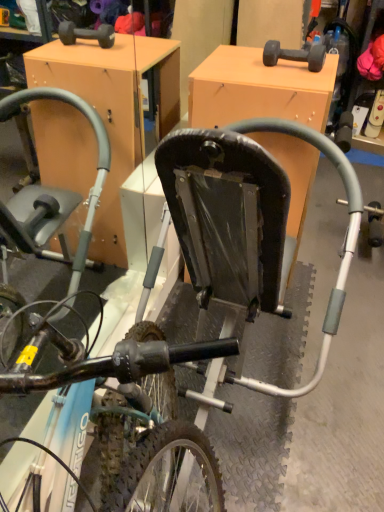
Question: Considering the positions of matte orange cabinet at center and metallic silver bicycle at center in the image, is matte orange cabinet at center taller or shorter than metallic silver bicycle at center?

Choices:
 (A) short
 (B) tall

Answer: (A)

Question: Considering the positions of matte orange cabinet at center and metallic silver bicycle at center in the image, is matte orange cabinet at center wider or thinner than metallic silver bicycle at center?

Choices:
 (A) thin
 (B) wide

Answer: (B)

Question: Considering the positions of matte orange cabinet at center and metallic silver bicycle at center in the image, is matte orange cabinet at center bigger or smaller than metallic silver bicycle at center?

Choices:
 (A) small
 (B) big

Answer: (B)

Question: Is metallic silver bicycle at center wider or thinner than matte orange cabinet at center?

Choices:
 (A) thin
 (B) wide

Answer: (A)

Question: Considering their positions, is metallic silver bicycle at center located in front of or behind matte orange cabinet at center?

Choices:
 (A) behind
 (B) front

Answer: (B)

Question: From the image's perspective, is metallic silver bicycle at center positioned above or below matte orange cabinet at center?

Choices:
 (A) below
 (B) above

Answer: (B)

Question: Is metallic silver bicycle at center bigger or smaller than matte orange cabinet at center?

Choices:
 (A) small
 (B) big

Answer: (A)